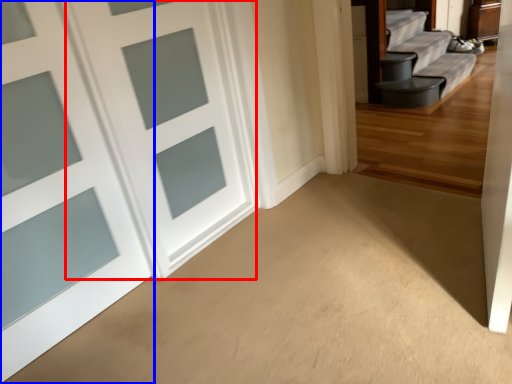
Question: Among these objects, which one is farthest to the camera, door (highlighted by a red box) or door (highlighted by a blue box)?

Choices:
 (A) door
 (B) door

Answer: (A)